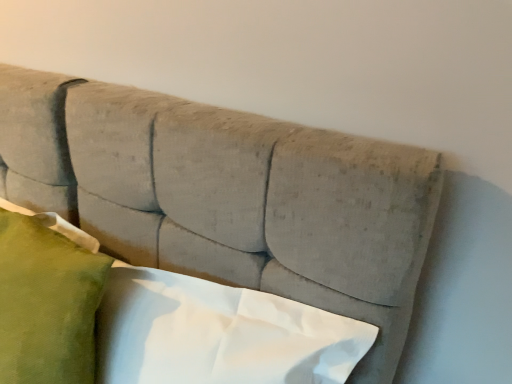
Find the location of a particular element. This screenshot has height=384, width=512. green velvet pillow at left is located at coordinates (47, 303).

What do you see at coordinates (47, 303) in the screenshot? I see `green velvet pillow at left` at bounding box center [47, 303].

This screenshot has width=512, height=384. In order to click on green velvet pillow at left in this screenshot , I will do `click(47, 303)`.